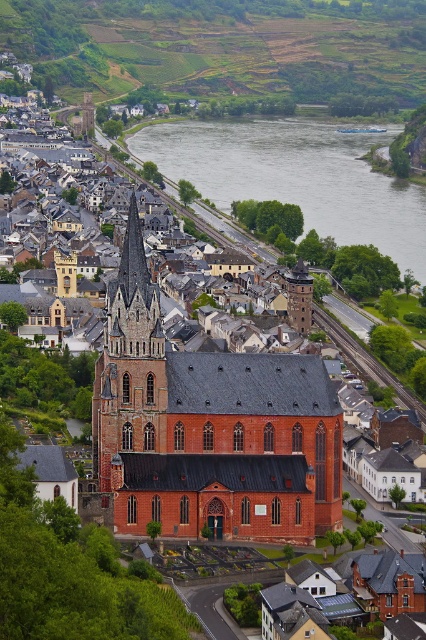
Who is positioned more to the right, gray/smooth water at center or dark gray stone tower at center?

gray/smooth water at center

The image size is (426, 640). Find the location of `gray/smooth water at center`. gray/smooth water at center is located at coordinates (296, 177).

From the picture: Is brick steeple at center to the left of dark brown stone spire at upper left from the viewer's perspective?

Indeed, brick steeple at center is positioned on the left side of dark brown stone spire at upper left.

Does point (155, 355) come in front of point (111, 296)?

Yes, point (155, 355) is closer to viewer.

Identify the location of brick steeple at center. (129, 364).

Is gray/smooth water at center thinner than dark brown stone spire at upper left?

Incorrect, gray/smooth water at center's width is not less than dark brown stone spire at upper left's.

Who is positioned more to the right, gray/smooth water at center or dark brown stone spire at upper left?

From the viewer's perspective, gray/smooth water at center appears more on the right side.

This screenshot has width=426, height=640. What are the coordinates of `gray/smooth water at center` in the screenshot? It's located at (296, 177).

Find the location of a particular element. Image resolution: width=426 pixels, height=640 pixels. gray/smooth water at center is located at coordinates (296, 177).